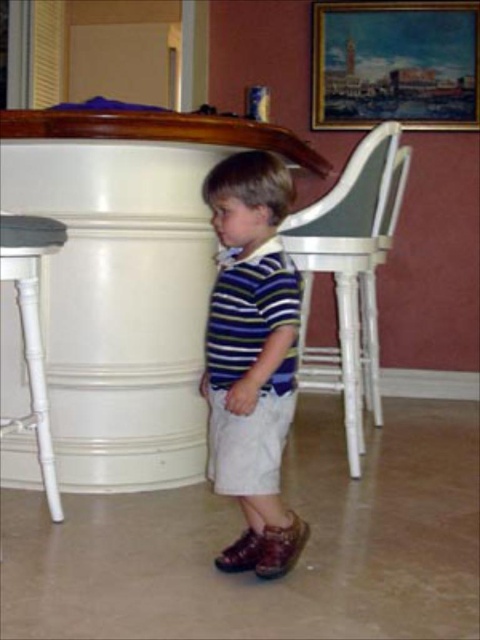
Question: Is striped cotton shirt at center wider than oil painting at upper right?

Choices:
 (A) yes
 (B) no

Answer: (B)

Question: Considering the relative positions of striped cotton shirt at center and white wood bar stool at left in the image provided, where is striped cotton shirt at center located with respect to white wood bar stool at left?

Choices:
 (A) right
 (B) left

Answer: (A)

Question: Which of the following is the closest to the observer?

Choices:
 (A) striped cotton shirt at center
 (B) white glossy table at left

Answer: (A)

Question: Is striped cotton shirt at center further to the viewer compared to white wood bar stool at left?

Choices:
 (A) no
 (B) yes

Answer: (A)

Question: Which object is the closest to the white wood bar stool at left?

Choices:
 (A) white glossy table at left
 (B) striped cotton shirt at center
 (C) oil painting at upper right
 (D) white wood chair at center

Answer: (A)

Question: Which point is closer to the camera?

Choices:
 (A) (26, 307)
 (B) (50, 369)
 (C) (361, 216)
 (D) (300, 532)

Answer: (D)